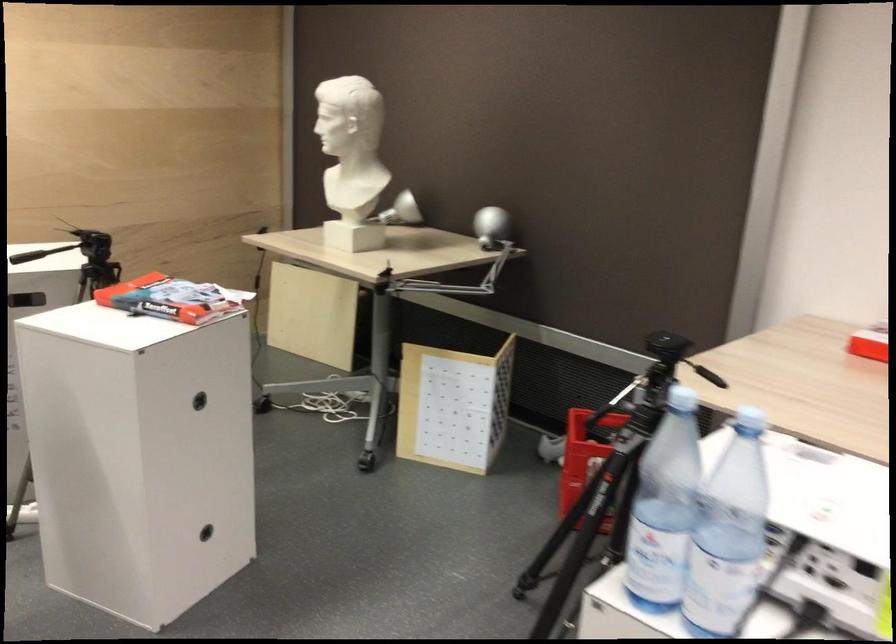
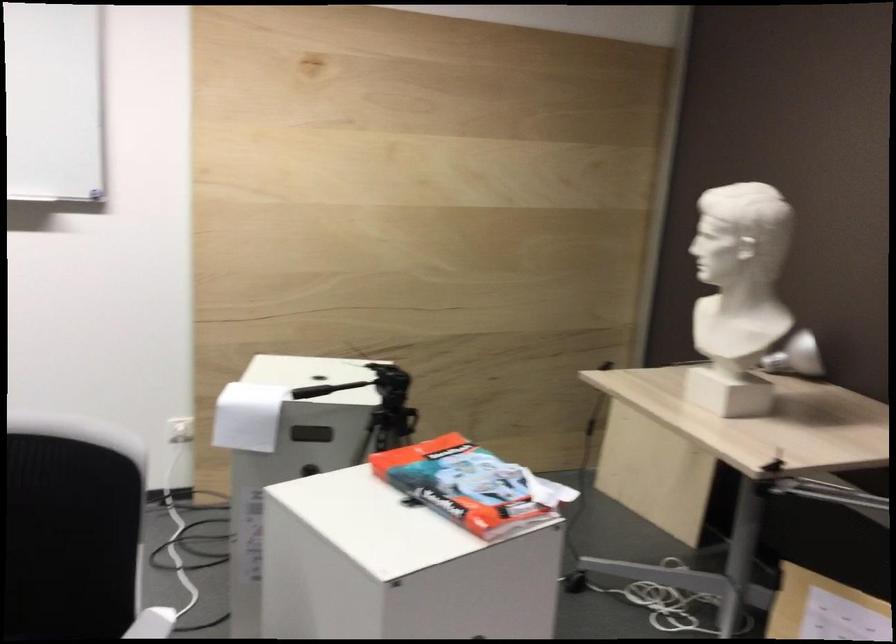
Question: I am providing you with two images of the same scene from different viewpoints. Please identify which objects are invisible in image2.

Choices:
 (A) white sculpture bust
 (B) silver lamp head
 (C) tripod adjustment handle
 (D) none of these

Answer: (D)